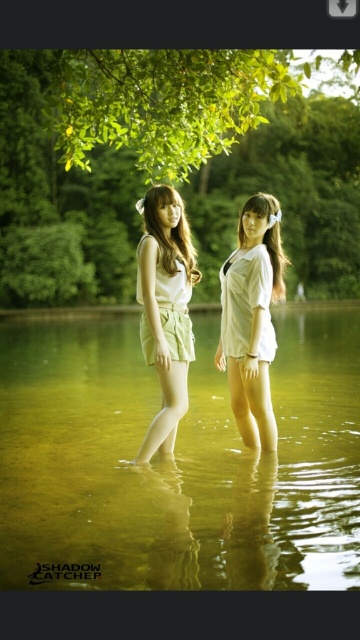
Question: Can you confirm if clear water at center is positioned below light green cotton shorts at center?

Choices:
 (A) no
 (B) yes

Answer: (B)

Question: Which of these objects is positioned farthest from the clear water at center?

Choices:
 (A) light green cotton shorts at center
 (B) white matte shirt at center

Answer: (A)

Question: Can you confirm if clear water at center is positioned to the right of white matte shirt at center?

Choices:
 (A) yes
 (B) no

Answer: (B)

Question: Which object is farther from the camera taking this photo?

Choices:
 (A) white matte shirt at center
 (B) clear water at center
 (C) light green cotton shorts at center

Answer: (A)

Question: Does clear water at center appear on the left side of white matte shirt at center?

Choices:
 (A) no
 (B) yes

Answer: (B)

Question: Which is nearer to the light green cotton shorts at center?

Choices:
 (A) white matte shirt at center
 (B) clear water at center

Answer: (A)